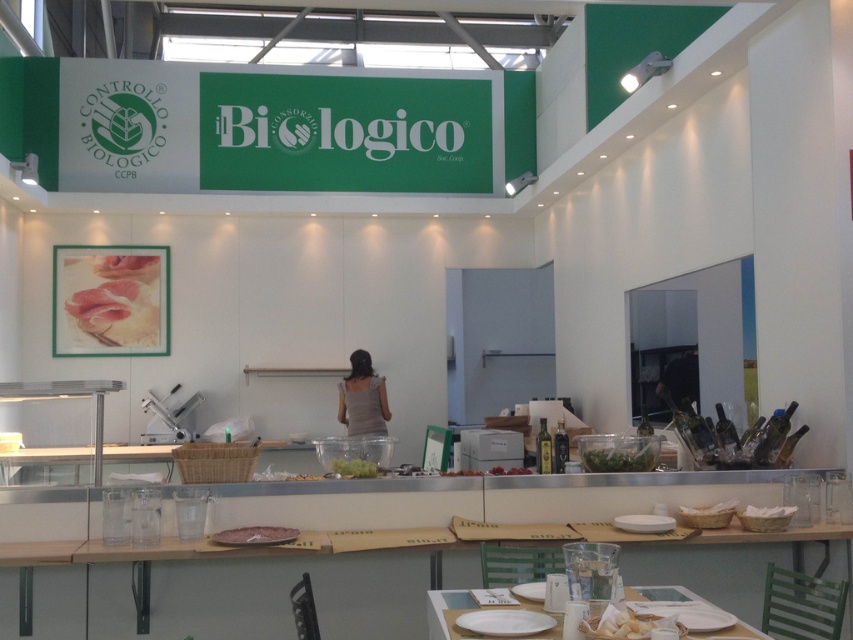
Is gray fabric dress at center positioned before green leafy vegetable at center?

No, it is not.

Can you confirm if gray fabric dress at center is positioned to the right of green leafy vegetable at center?

Incorrect, gray fabric dress at center is not on the right side of green leafy vegetable at center.

The image size is (853, 640). Describe the element at coordinates (363, 400) in the screenshot. I see `gray fabric dress at center` at that location.

Find the location of a particular element. The image size is (853, 640). gray fabric dress at center is located at coordinates (363, 400).

Between white paper napkin at lower right and green leafy salad at center, which one has less height?

Standing shorter between the two is green leafy salad at center.

Which is more to the right, white paper napkin at lower right or green leafy salad at center?

From the viewer's perspective, white paper napkin at lower right appears more on the right side.

Is point (641, 618) more distant than point (340, 472)?

No, (641, 618) is closer to viewer.

Where is `white paper napkin at lower right`? The height and width of the screenshot is (640, 853). white paper napkin at lower right is located at coordinates (627, 625).

Can you confirm if pinkish matte meat at lower center is smaller than green leafy salad at center?

Actually, pinkish matte meat at lower center might be larger than green leafy salad at center.

Does pinkish matte meat at lower center have a lesser width compared to green leafy salad at center?

Incorrect, pinkish matte meat at lower center's width is not less than green leafy salad at center's.

Which is behind, point (274, 534) or point (375, 472)?

The point (375, 472) is more distant.

Where is `pinkish matte meat at lower center`? pinkish matte meat at lower center is located at coordinates (254, 536).